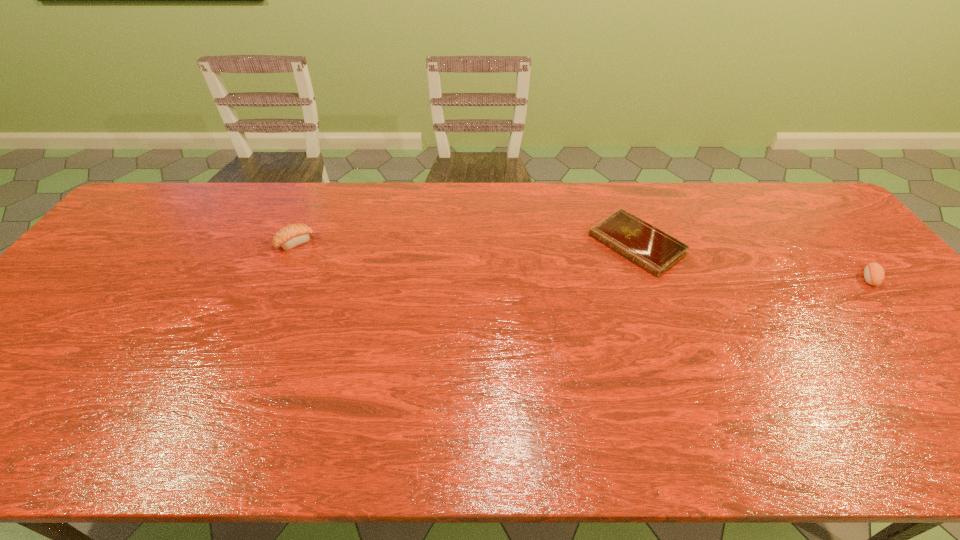
Find the location of a particular element. free spot between the rightmost object and the second object from right to left is located at coordinates [753, 261].

You are a GUI agent. You are given a task and a screenshot of the screen. Output one action in this format:
    pyautogui.click(x=<x>, y=<y>)
    Task: Click on the vacant area that lies between the nearer sushi and the leftmost object
    
    Given the screenshot: What is the action you would take?
    pyautogui.click(x=582, y=260)

What are the coordinates of `free space between the right sushi and the leftmost object` in the screenshot? It's located at (582, 260).

Locate an element on the screen. Image resolution: width=960 pixels, height=540 pixels. blank region between the rightmost object and the notebook is located at coordinates (753, 261).

What are the coordinates of `vacant space that is in between the second object from left to right and the farther sushi` in the screenshot? It's located at (466, 244).

Identify which object is located as the second nearest to the second object from right to left. Please provide its 2D coordinates. Your answer should be formatted as a tuple, i.e. [(x, y)], where the tuple contains the x and y coordinates of a point satisfying the conditions above.

[(293, 235)]

Find the location of a particular element. The height and width of the screenshot is (540, 960). object identified as the second closest to the leftmost object is located at coordinates (874, 274).

Image resolution: width=960 pixels, height=540 pixels. I want to click on blank area in the image that satisfies the following two spatial constraints: 1. on the front side of the nearer sushi; 2. on the right side of the leftmost object, so click(280, 278).

This screenshot has height=540, width=960. Find the location of `vacant space that satisfies the following two spatial constraints: 1. on the front side of the nearer sushi; 2. on the right side of the left sushi`. vacant space that satisfies the following two spatial constraints: 1. on the front side of the nearer sushi; 2. on the right side of the left sushi is located at coordinates (280, 278).